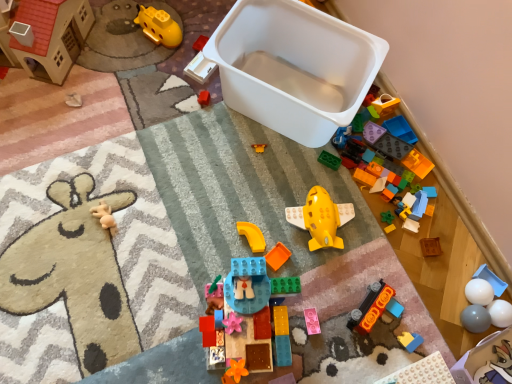
I want to click on vacant space in between beige rubber bear at left, placed as the 2th toy when sorted from left to right, and orange matte car at lower right, the 8th toy in the right-to-left sequence, so click(x=234, y=257).